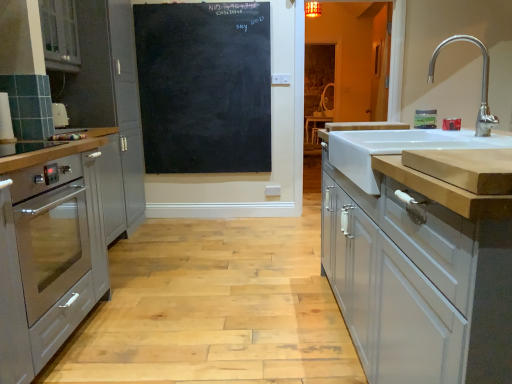
Identify the location of vacant area that is situated to the right of satin silver oven at left, which is the third cabinetry in left-to-right order. (177, 347).